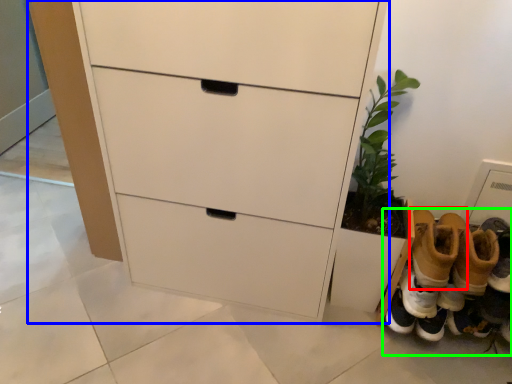
Question: Which object is positioned closest to footwear (highlighted by a red box)? Select from chest of drawers (highlighted by a blue box) and footwear (highlighted by a green box).

Choices:
 (A) chest of drawers
 (B) footwear

Answer: (B)